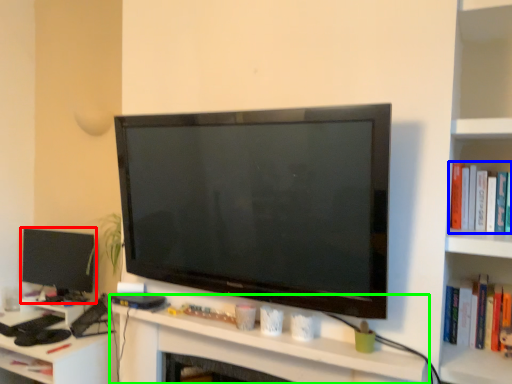
Question: Which object is positioned closest to television (highlighted by a red box)? Select from book (highlighted by a blue box) and computer (highlighted by a green box).

Choices:
 (A) book
 (B) computer

Answer: (B)